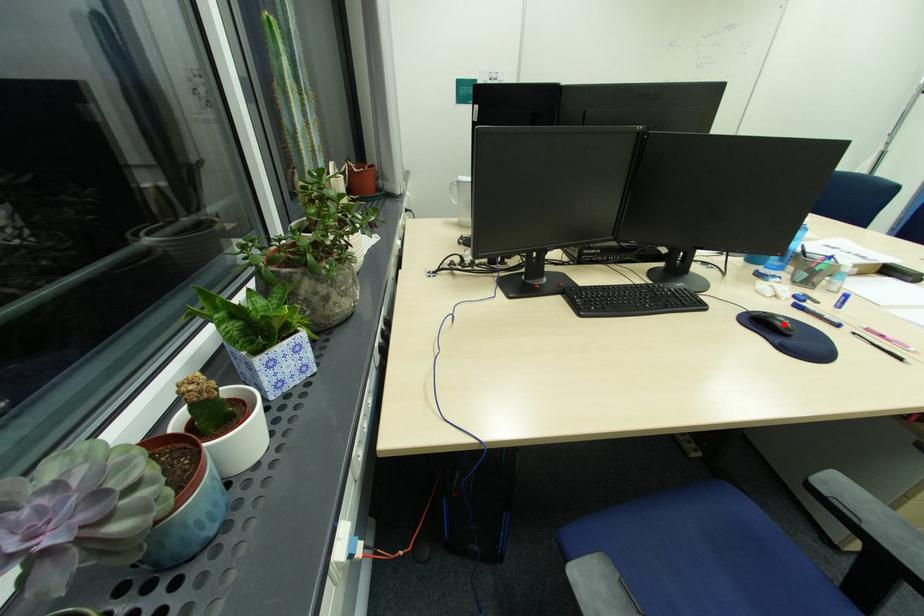
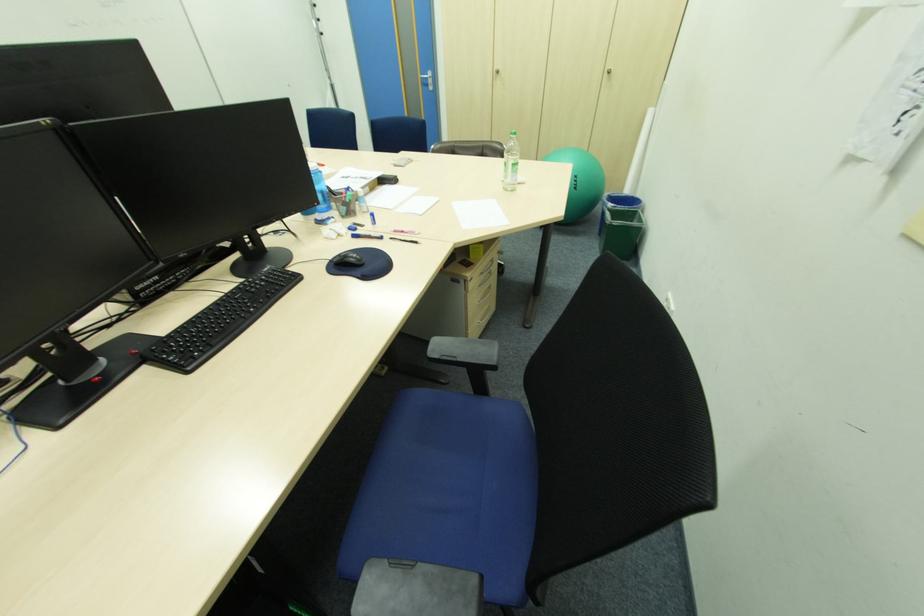
The point at the highlighted location is marked in the first image. Where is the corresponding point in the second image?

(357, 260)